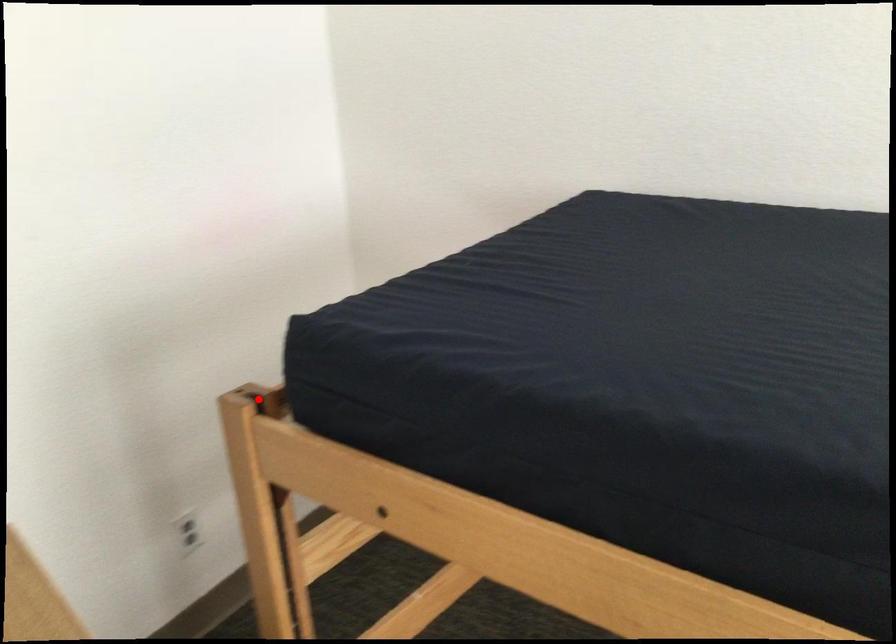
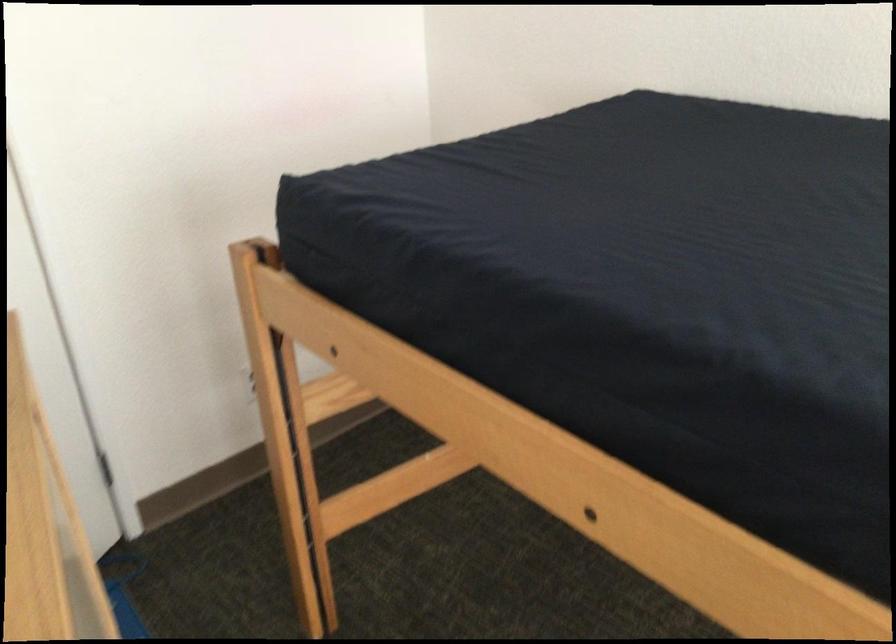
Locate, in the second image, the point that corresponds to the highlighted location in the first image.

(262, 251)